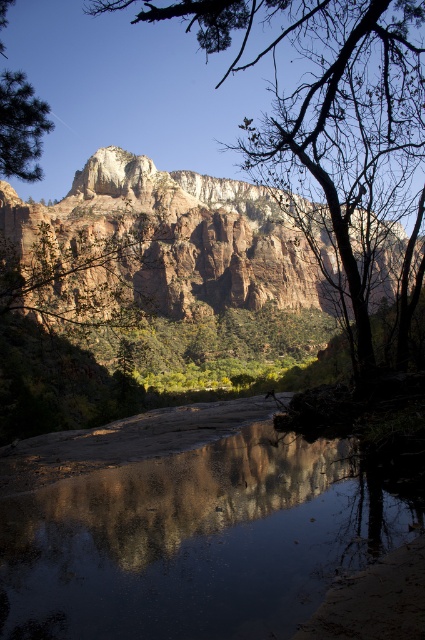
Is smooth reflective water at center taller than smooth bark tree at upper center?

No, smooth reflective water at center is not taller than smooth bark tree at upper center.

Consider the image. Who is more distant from viewer, (294,557) or (365,29)?

Positioned behind is point (365,29).

Which is behind, point (147, 573) or point (316, 214)?

Point (316, 214)

At what (x,y) coordinates should I click in order to perform the action: click on smooth reflective water at center. Please return your answer as a coordinate pair (x, y). This screenshot has height=640, width=425. Looking at the image, I should click on (186, 528).

Does rugged sandstone mountain at upper center have a greater width compared to green matte tree at upper left?

Yes, rugged sandstone mountain at upper center is wider than green matte tree at upper left.

Who is taller, rugged sandstone mountain at upper center or green matte tree at upper left?

With more height is rugged sandstone mountain at upper center.

Which is behind, point (138, 170) or point (2, 144)?

The point (138, 170) is behind.

Identify the location of rugged sandstone mountain at upper center. (183, 236).

In order to click on smooth reflective water at center in this screenshot , I will do `click(186, 528)`.

Between point (314, 547) and point (5, 100), which one is positioned in front?

Point (314, 547) is more forward.

Which is behind, point (87, 586) or point (47, 131)?

Point (47, 131)

The height and width of the screenshot is (640, 425). What are the coordinates of `smooth reflective water at center` in the screenshot? It's located at (186, 528).